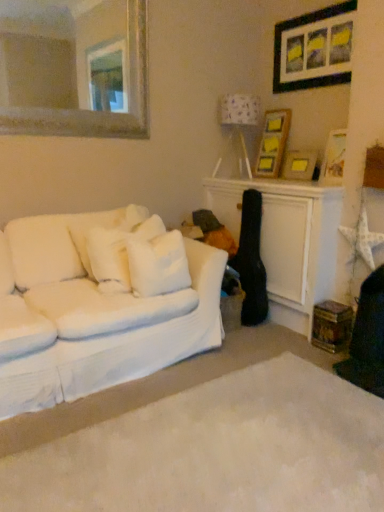
Measure the distance between point (313, 75) and camera.

A distance of 3.02 meters exists between point (313, 75) and camera.

Image resolution: width=384 pixels, height=512 pixels. What do you see at coordinates (313, 49) in the screenshot?
I see `black matte picture frame at upper right, which ranks as the first picture frame in top-to-bottom order` at bounding box center [313, 49].

Measure the distance between white soft pillow at center, the second pillow positioned from the left, and camera.

The depth of white soft pillow at center, the second pillow positioned from the left, is 7.18 feet.

This screenshot has height=512, width=384. What do you see at coordinates (367, 338) in the screenshot? I see `wooden swivel chair at lower right` at bounding box center [367, 338].

Measure the distance between wooden swivel chair at lower right and camera.

wooden swivel chair at lower right and camera are 2.01 meters apart.

This screenshot has height=512, width=384. What do you see at coordinates (238, 125) in the screenshot? I see `white fabric lampshade at upper right` at bounding box center [238, 125].

What do you see at coordinates (74, 68) in the screenshot?
I see `gold-framed mirror at upper left` at bounding box center [74, 68].

Locate an element on the screen. The width and height of the screenshot is (384, 512). wooden picture frame at upper right, which is the 3th picture frame in bottom-to-top order is located at coordinates (272, 143).

What do you see at coordinates (272, 143) in the screenshot? I see `wooden picture frame at upper right, which is the 3th picture frame in bottom-to-top order` at bounding box center [272, 143].

Where is `black matte picture frame at upper right, which ranks as the first picture frame in top-to-bottom order`? Image resolution: width=384 pixels, height=512 pixels. black matte picture frame at upper right, which ranks as the first picture frame in top-to-bottom order is located at coordinates (313, 49).

How different are the orientations of gold-framed mirror at upper left and white fabric couch at left in degrees?

0.197 degrees separate the facing orientations of gold-framed mirror at upper left and white fabric couch at left.

Measure the distance between gold-framed mirror at upper left and white fabric couch at left.

gold-framed mirror at upper left and white fabric couch at left are 9.56 feet apart.

From the picture: Can you confirm if gold-framed mirror at upper left is positioned to the left of white fabric couch at left?

Correct, you'll find gold-framed mirror at upper left to the left of white fabric couch at left.

Which of these two, gold-framed mirror at upper left or white fabric couch at left, is wider?

white fabric couch at left.

Is black matte picture frame at upper right, which ranks as the fourth picture frame in bottom-to-top order, looking in the opposite direction of wooden swivel chair at lower right?

No.

From a real-world perspective, which is physically below, black matte picture frame at upper right, which ranks as the fourth picture frame in bottom-to-top order, or wooden swivel chair at lower right?

From a 3D spatial view, wooden swivel chair at lower right is below.

Which object is wider, black matte picture frame at upper right, which ranks as the fourth picture frame in bottom-to-top order, or wooden swivel chair at lower right?

Wider between the two is wooden swivel chair at lower right.

From the image's perspective, is black matte picture frame at upper right, which ranks as the fourth picture frame in bottom-to-top order, located above or below wooden picture frame at upper right, which is the fourth picture frame in top-to-bottom order?

Based on their image positions, black matte picture frame at upper right, which ranks as the fourth picture frame in bottom-to-top order, is located above wooden picture frame at upper right, which is the fourth picture frame in top-to-bottom order.

From the image's perspective, starting from the black matte picture frame at upper right, which ranks as the fourth picture frame in bottom-to-top order, which picture frame is the 3rd one below? Please provide its 2D coordinates.

[(299, 165)]

Is black matte picture frame at upper right, which ranks as the fourth picture frame in bottom-to-top order, inside the boundaries of wooden picture frame at upper right, the first picture frame positioned from the bottom, or outside?

black matte picture frame at upper right, which ranks as the fourth picture frame in bottom-to-top order, is spatially situated outside wooden picture frame at upper right, the first picture frame positioned from the bottom.

Can you confirm if wooden picture frame at upper right, which is the 3th picture frame in bottom-to-top order, is bigger than white soft pillow at left, acting as the first pillow starting from the left?

Incorrect, wooden picture frame at upper right, which is the 3th picture frame in bottom-to-top order, is not larger than white soft pillow at left, acting as the first pillow starting from the left.

How many degrees apart are the facing directions of wooden picture frame at upper right, which is the 3th picture frame in bottom-to-top order, and white soft pillow at left, marked as the second pillow in a right-to-left arrangement?

They differ by 85.6 degrees in their facing directions.

From the image's perspective, is wooden picture frame at upper right, which appears as the 2th picture frame when viewed from the top, located above or below white soft pillow at left, acting as the first pillow starting from the left?

From the image's perspective, wooden picture frame at upper right, which appears as the 2th picture frame when viewed from the top, appears above white soft pillow at left, acting as the first pillow starting from the left.

From their relative heights in the image, would you say white fabric lampshade at upper right is taller or shorter than wooden picture frame at upper right, which is the fourth picture frame in top-to-bottom order?

In the image, white fabric lampshade at upper right appears to be taller than wooden picture frame at upper right, which is the fourth picture frame in top-to-bottom order.

Considering the relative sizes of white fabric lampshade at upper right and wooden picture frame at upper right, which is the fourth picture frame in top-to-bottom order, in the image provided, is white fabric lampshade at upper right bigger than wooden picture frame at upper right, which is the fourth picture frame in top-to-bottom order,?

Indeed, white fabric lampshade at upper right has a larger size compared to wooden picture frame at upper right, which is the fourth picture frame in top-to-bottom order.

At what (x,y) coordinates should I click in order to perform the action: click on lamp on the left side of wooden picture frame at upper right, the first picture frame positioned from the bottom. Please return your answer as a coordinate pair (x, y). This screenshot has height=512, width=384. Looking at the image, I should click on (238, 125).

Is the position of white fabric lampshade at upper right more distant than that of wooden picture frame at upper right, which is the fourth picture frame in top-to-bottom order?

Yes, white fabric lampshade at upper right is further from the viewer.

In the scene shown: From a real-world perspective, which object stands above the other?

wooden picture frame at upper right, which ranks as the third picture frame in top-to-bottom order.

Can you confirm if wooden picture frame at upper right, which ranks as the third picture frame in top-to-bottom order, is taller than white soft pillow at left, marked as the second pillow in a right-to-left arrangement?

In fact, wooden picture frame at upper right, which ranks as the third picture frame in top-to-bottom order, may be shorter than white soft pillow at left, marked as the second pillow in a right-to-left arrangement.

There is a white soft pillow at left, acting as the first pillow starting from the left. What are the coordinates of `the 2nd picture frame above it (from a real-world perspective)` in the screenshot? It's located at (334, 158).

Can you confirm if white soft carpet at lower center is wider than wooden picture frame at upper right, positioned as the second picture frame in bottom-to-top order?

Yes, white soft carpet at lower center is wider than wooden picture frame at upper right, positioned as the second picture frame in bottom-to-top order.

From a real-world perspective, is white soft carpet at lower center on wooden picture frame at upper right, which ranks as the third picture frame in top-to-bottom order?

No, from a real-world perspective, white soft carpet at lower center is not on top of wooden picture frame at upper right, which ranks as the third picture frame in top-to-bottom order.

Which is more to the left, white soft carpet at lower center or wooden picture frame at upper right, which ranks as the third picture frame in top-to-bottom order?

white soft carpet at lower center is more to the left.

Considering the sizes of objects white soft carpet at lower center and wooden picture frame at upper right, which ranks as the third picture frame in top-to-bottom order, in the image provided, who is smaller, white soft carpet at lower center or wooden picture frame at upper right, which ranks as the third picture frame in top-to-bottom order,?

wooden picture frame at upper right, which ranks as the third picture frame in top-to-bottom order.

Where is `mirror above the white fabric couch at left (from a real-world perspective)`? The height and width of the screenshot is (512, 384). mirror above the white fabric couch at left (from a real-world perspective) is located at coordinates (74, 68).

Which picture frame is the 2nd one when counting from the left side of the wooden swivel chair at lower right? Please provide its 2D coordinates.

[(313, 49)]

Considering their positions, is wooden picture frame at upper right, which is the 3th picture frame in bottom-to-top order, positioned closer to gold-framed mirror at upper left than white fabric couch at left?

Based on the image, wooden picture frame at upper right, which is the 3th picture frame in bottom-to-top order, appears to be nearer to gold-framed mirror at upper left.

Which object lies further to the anchor point black matte picture frame at upper right, which ranks as the first picture frame in top-to-bottom order, white soft pillow at center, the second pillow positioned from the left, or wooden picture frame at upper right, the first picture frame positioned from the bottom?

Based on the image, white soft pillow at center, the second pillow positioned from the left, appears to be further to black matte picture frame at upper right, which ranks as the first picture frame in top-to-bottom order.

Looking at the image, which one is located closer to white soft pillow at left, acting as the first pillow starting from the left, wooden picture frame at upper right, the first picture frame positioned from the bottom, or white soft pillow at center, the second pillow positioned from the left?

Based on the image, white soft pillow at center, the second pillow positioned from the left, appears to be nearer to white soft pillow at left, acting as the first pillow starting from the left.

Looking at this image, considering their positions, is gold-framed mirror at upper left positioned closer to wooden picture frame at upper right, positioned as the second picture frame in bottom-to-top order, than white fabric couch at left?

Based on the image, white fabric couch at left appears to be nearer to wooden picture frame at upper right, positioned as the second picture frame in bottom-to-top order.

Based on their spatial positions, is gold-framed mirror at upper left or black matte picture frame at upper right, which ranks as the first picture frame in top-to-bottom order, closer to wooden swivel chair at lower right?

black matte picture frame at upper right, which ranks as the first picture frame in top-to-bottom order, is positioned closer to the anchor wooden swivel chair at lower right.

Considering their positions, is white soft pillow at center, the first pillow when ordered from right to left, positioned further to wooden picture frame at upper right, the first picture frame positioned from the bottom, than white soft pillow at left, acting as the first pillow starting from the left?

Among the two, white soft pillow at left, acting as the first pillow starting from the left, is located further to wooden picture frame at upper right, the first picture frame positioned from the bottom.

Estimate the real-world distances between objects in this image. Which object is closer to black matte picture frame at upper right, which ranks as the first picture frame in top-to-bottom order, white fabric lampshade at upper right or white soft carpet at lower center?

white fabric lampshade at upper right is positioned closer to the anchor black matte picture frame at upper right, which ranks as the first picture frame in top-to-bottom order.

Based on their spatial positions, is wooden picture frame at upper right, the first picture frame positioned from the bottom, or wooden swivel chair at lower right further from white soft carpet at lower center?

wooden picture frame at upper right, the first picture frame positioned from the bottom, lies further to white soft carpet at lower center than the other object.

The width and height of the screenshot is (384, 512). I want to click on lamp that lies between black matte picture frame at upper right, which ranks as the fourth picture frame in bottom-to-top order, and wooden picture frame at upper right, which is the 3th picture frame in bottom-to-top order, from top to bottom, so click(238, 125).

Image resolution: width=384 pixels, height=512 pixels. In order to click on lamp located between gold-framed mirror at upper left and wooden picture frame at upper right, which appears as the 2th picture frame when viewed from the top, in the left-right direction in this screenshot , I will do `click(238, 125)`.

You are a GUI agent. You are given a task and a screenshot of the screen. Output one action in this format:
    pyautogui.click(x=<x>, y=<y>)
    Task: Click on the swivel chair between black matte picture frame at upper right, which ranks as the first picture frame in top-to-bottom order, and white soft carpet at lower center, in the vertical direction
    
    Given the screenshot: What is the action you would take?
    pyautogui.click(x=367, y=338)

Identify the location of lamp between black matte picture frame at upper right, which ranks as the fourth picture frame in bottom-to-top order, and white soft carpet at lower center, in the vertical direction. (238, 125).